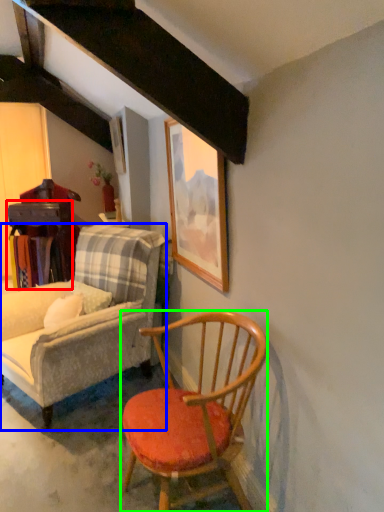
Question: Which object is positioned farthest from table (highlighted by a red box)? Select from chair (highlighted by a blue box) and chair (highlighted by a green box).

Choices:
 (A) chair
 (B) chair

Answer: (B)